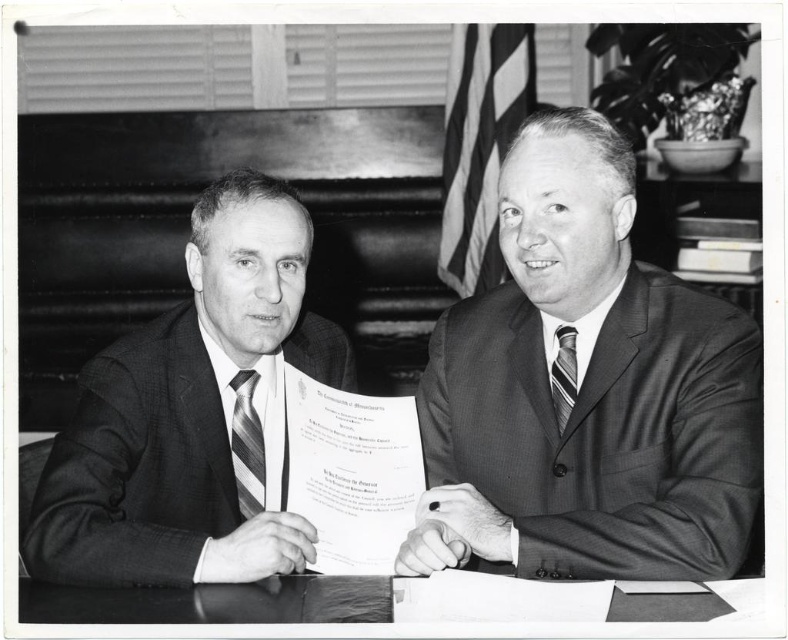
You are a photographer who wants to capture a closeup of the striped fabric tie at center without including the black wood table at lower center in the frame. Given that your camera has a fixed focal length, can you estimate if moving backward by 10 inches from your current position will allow you to exclude the table?

The distance between the black wood table at lower center and the striped fabric tie at center is 20.88 inches. If you move back 10 inches, you would still be 10.88 inches away from the table, so the table would still be in the frame. Therefore, moving back 10 inches is insufficient to exclude the table.

You are a photographer who needs to position a new lamp on the table in the image. The lamp must be placed between the black wood table at lower center and the striped silk tie at left. Is this possible?

The black wood table at lower center is located below the striped silk tie at left, so there is no space between them. Therefore, placing the lamp between them is not possible.

You are a photographer who wants to capture a closeup of the striped fabric tie at center without including the black wood table at lower center in the frame. Is this possible given their positions?

The black wood table at lower center is located below the striped fabric tie at center, so the photographer can adjust the camera angle to focus on the tie above the table, excluding the table from the frame.